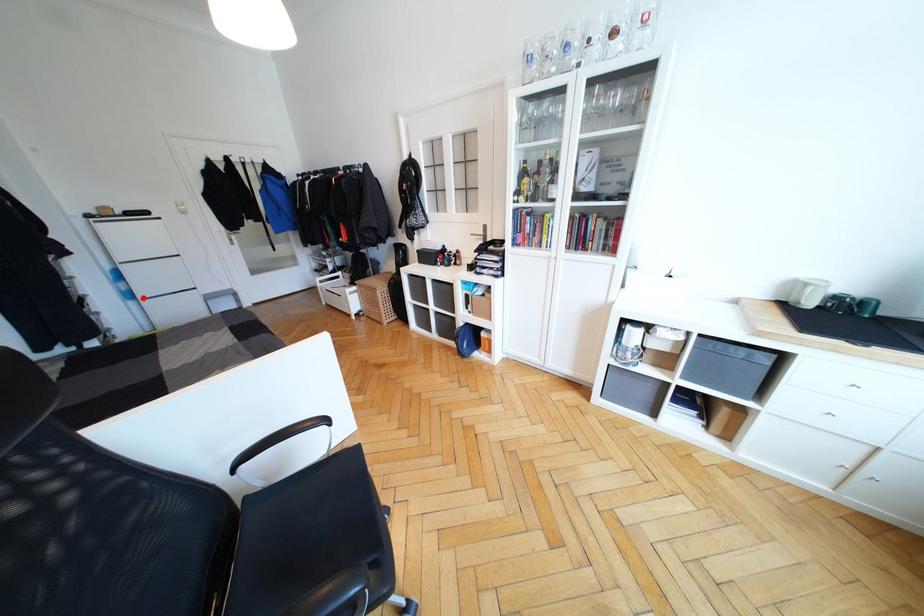
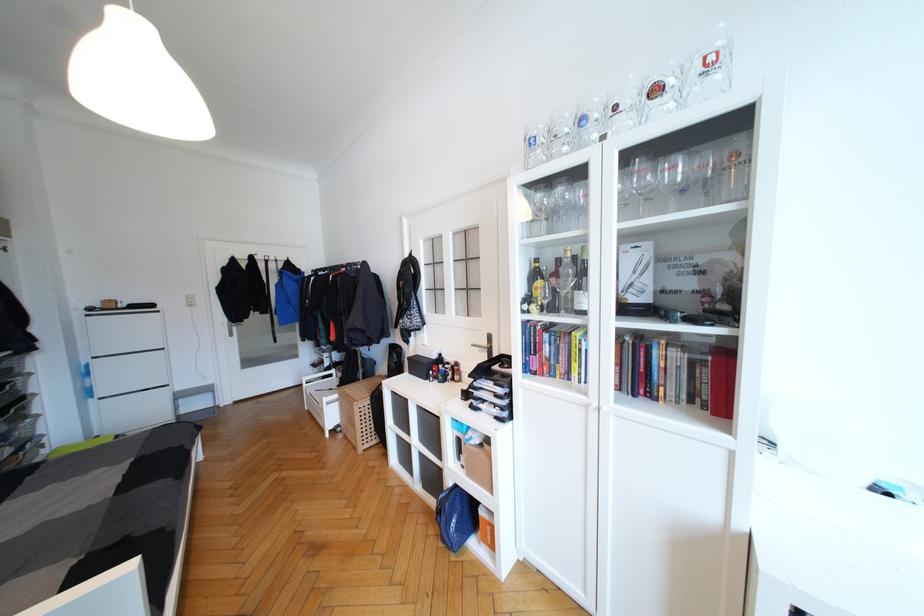
The point at the highlighted location is marked in the first image. Where is the corresponding point in the second image?

(103, 395)